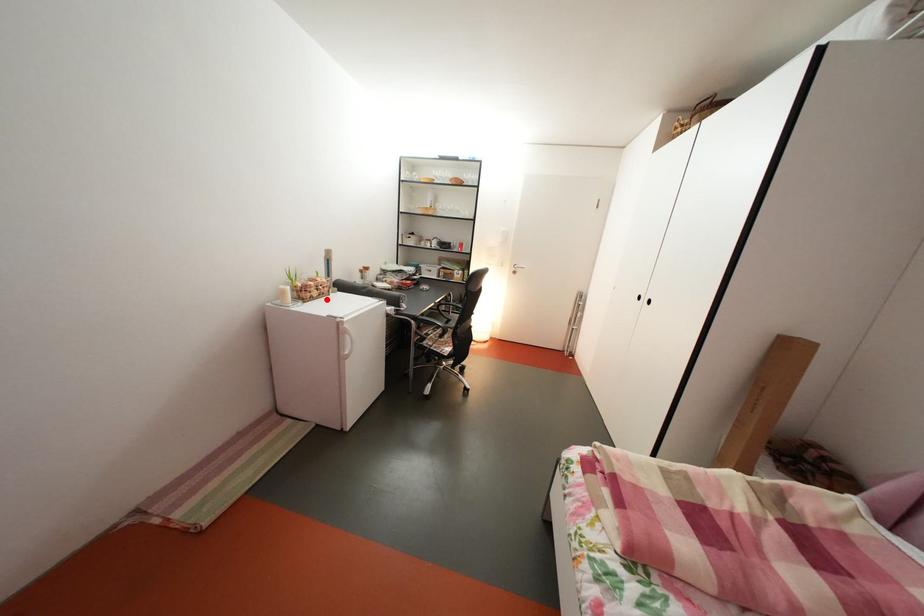
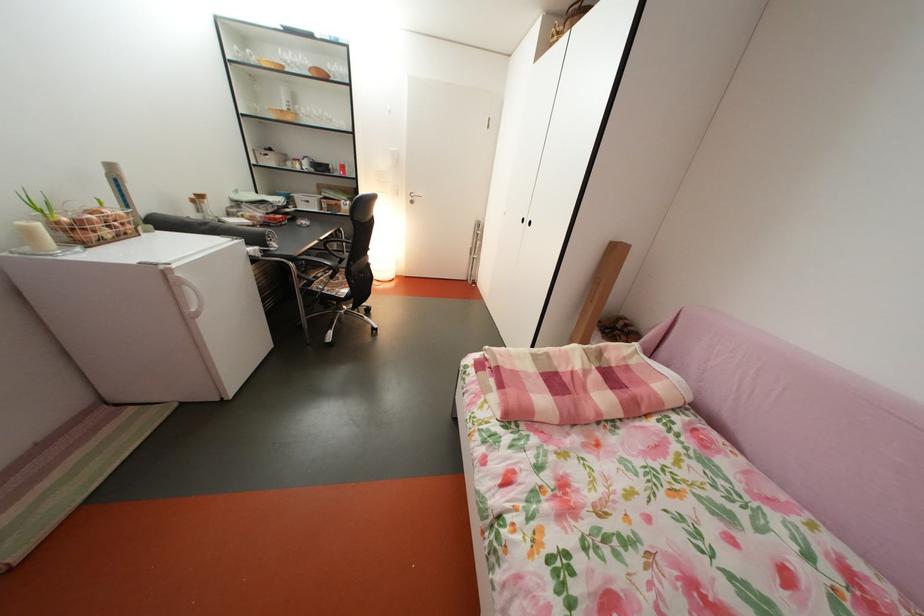
Where in the second image is the point corresponding to the highlighted location from the first image?

(118, 238)